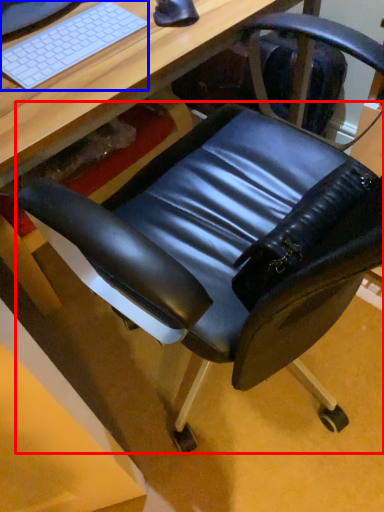
Question: Which object appears closest to the camera in this image, swivel chair (highlighted by a red box) or computer keyboard (highlighted by a blue box)?

Choices:
 (A) swivel chair
 (B) computer keyboard

Answer: (B)